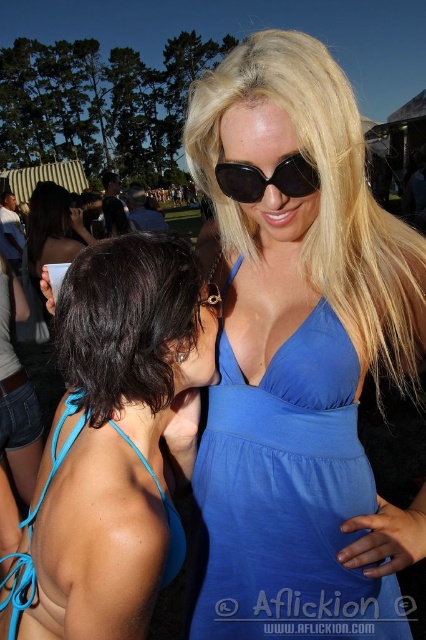
Question: Which point is farther from the camera taking this photo?

Choices:
 (A) (222, 186)
 (B) (152, 596)

Answer: (A)

Question: Considering the relative positions of blue fabric dress at center and shiny dark hair at center in the image provided, where is blue fabric dress at center located with respect to shiny dark hair at center?

Choices:
 (A) below
 (B) above

Answer: (A)

Question: Does shiny dark hair at center lie in front of black matte sunglasses at center?

Choices:
 (A) yes
 (B) no

Answer: (A)

Question: Which of the following is the closest to the observer?

Choices:
 (A) (68, 353)
 (B) (253, 192)
 (C) (348, 444)

Answer: (A)

Question: Is blue fabric bikini top at left bigger than shiny dark hair at center?

Choices:
 (A) yes
 (B) no

Answer: (A)

Question: Which object appears farthest from the camera in this image?

Choices:
 (A) black matte sunglasses at center
 (B) shiny dark hair at center
 (C) blue fabric bikini top at left
 (D) blue fabric dress at center

Answer: (D)